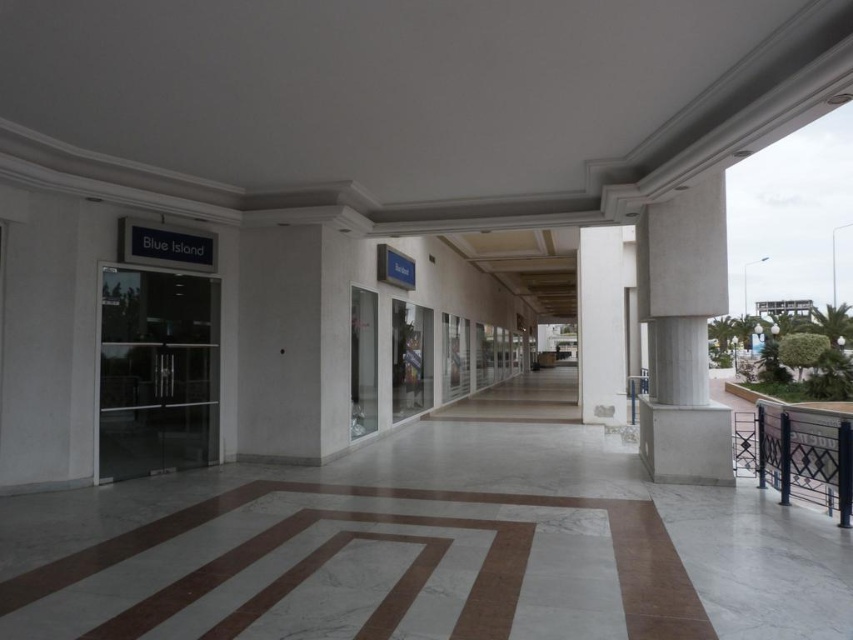
You are a delivery person trying to navigate through the shopping arcade. You need to pass between the white marble pillar at center and the black metal balustrade at lower right. Can you fit through the space if your cart is 1.2 meters wide?

The white marble pillar at center has a smaller size compared to the black metal balustrade at lower right. Since the pillar is smaller, the space between them might be sufficient for your cart. However, without exact measurements, it is uncertain. Consider checking the width before proceeding.

You are standing at the entrance of the shopping arcade and want to locate two specific points marked in the image. The first point is at coordinates point (633,308) and the second is at point (787,406). From your current position, which point is closer to you?

Point (787,406) is closer to you because the description states that point (633,308) is behind point (787,406), meaning the latter is nearer to your current position.

You are a delivery person carrying a large package that requires placing it on a support structure. You see the white marble pillar at right and the black metal balustrade at lower right. Which object can better support the weight of the package?

The white marble pillar at right is larger in size than the black metal balustrade at lower right, so it can better support the weight of the package.